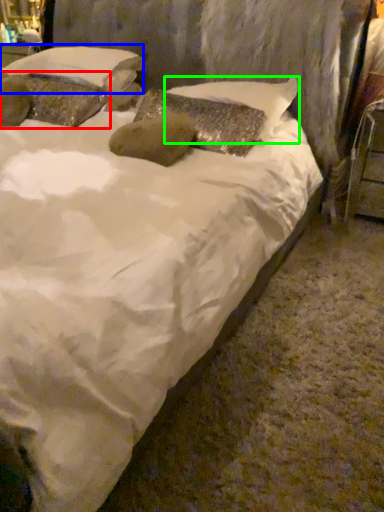
Question: Which object is the closest to the pillow (highlighted by a red box)? Choose among these: pillow (highlighted by a blue box) or pillow (highlighted by a green box).

Choices:
 (A) pillow
 (B) pillow

Answer: (A)